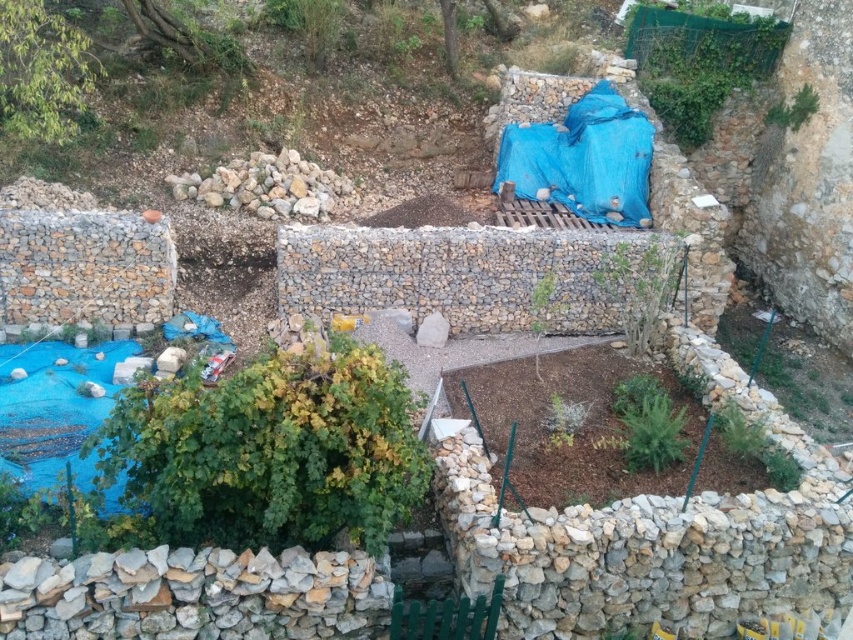
Identify the location of natural stone wall at lower left. (196, 595).

Does natural stone wall at lower left have a greater height compared to natural stone at center?

Incorrect, natural stone wall at lower left's height is not larger of natural stone at center's.

Measure the distance between natural stone wall at lower left and camera.

natural stone wall at lower left and camera are 7.65 meters apart.

Find the location of a particular element. This screenshot has height=640, width=853. natural stone wall at lower left is located at coordinates (196, 595).